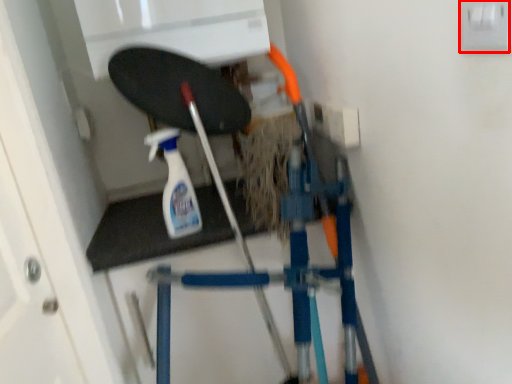
Question: From the image's perspective, what is the correct spatial positioning of electric outlet (annotated by the red box) in reference to cleaning product?

Choices:
 (A) above
 (B) below

Answer: (A)